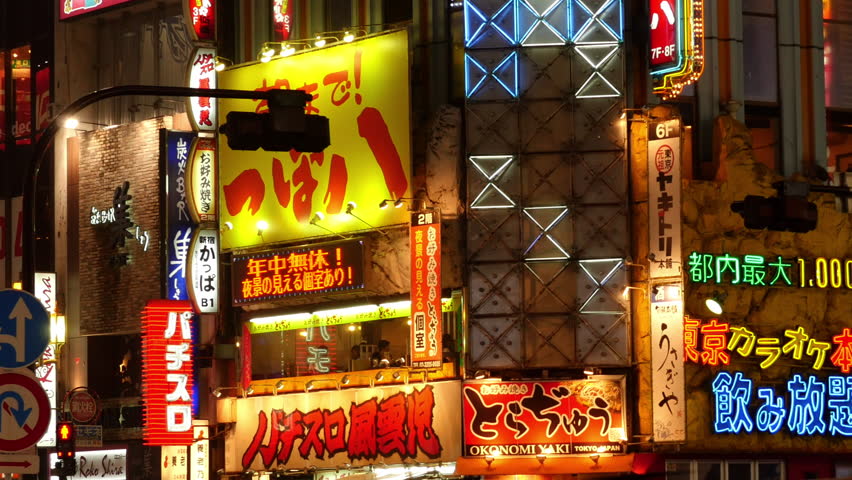
Identify the location of white neon light hourglass. The height and width of the screenshot is (480, 852). tap(488, 183), tap(540, 228), tap(602, 289), tap(600, 78), tap(544, 16), tap(590, 15).